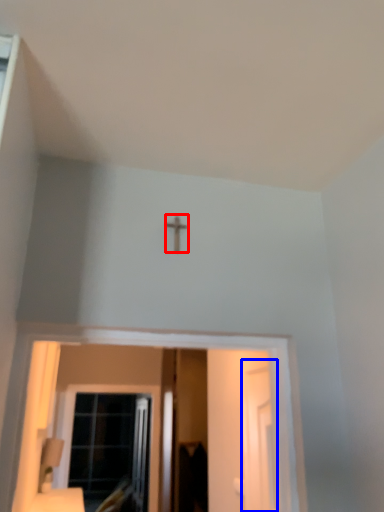
Question: Which object appears closest to the camera in this image, crucifix (highlighted by a red box) or screen door (highlighted by a blue box)?

Choices:
 (A) crucifix
 (B) screen door

Answer: (A)